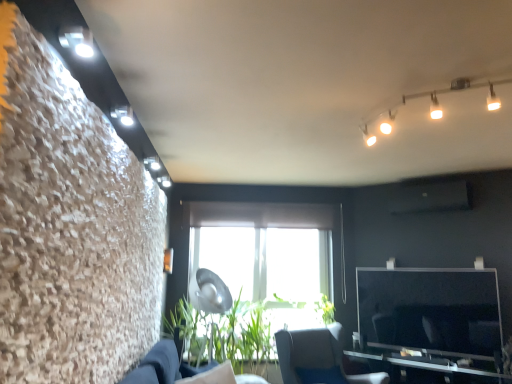
Question: Relative to green leafy plant at center, is metallic silver table at lower right in front or behind?

Choices:
 (A) front
 (B) behind

Answer: (A)

Question: In the image, is metallic silver table at lower right on the left side or the right side of green leafy plant at center?

Choices:
 (A) right
 (B) left

Answer: (A)

Question: Considering the real-world distances, which object is farthest from the dark blue fabric couch at lower center?

Choices:
 (A) metallic silver table at lower right
 (B) white glossy track lights at upper right
 (C) green leafy plant at center
 (D) blue fabric chair at center

Answer: (A)

Question: Which is nearer to the green leafy plant at center?

Choices:
 (A) white glossy track lights at upper right
 (B) dark blue fabric couch at lower center
 (C) metallic silver table at lower right
 (D) blue fabric chair at center

Answer: (D)